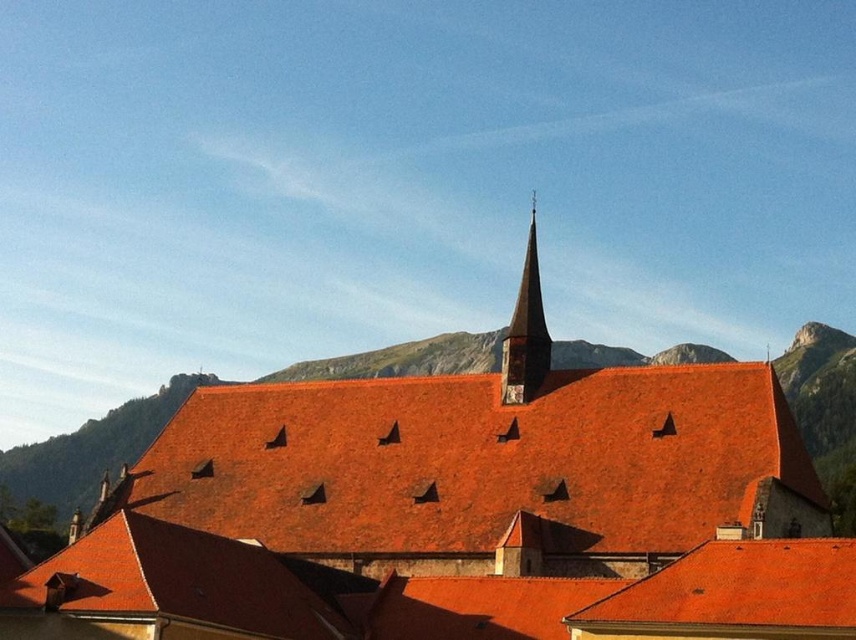
Is shiny orange tiles at center below smooth stone spire at upper center?

Indeed, shiny orange tiles at center is positioned under smooth stone spire at upper center.

The width and height of the screenshot is (856, 640). In order to click on shiny orange tiles at center in this screenshot , I will do `click(484, 464)`.

Which is in front, point (339, 522) or point (527, 385)?

Point (339, 522) is in front.

Locate an element on the screen. This screenshot has height=640, width=856. shiny orange tiles at center is located at coordinates (484, 464).

Between matte orange roof at center and shiny orange tiles at center, which one appears on the right side from the viewer's perspective?

shiny orange tiles at center

Who is positioned more to the left, matte orange roof at center or shiny orange tiles at center?

matte orange roof at center

Measure the distance between point [461,564] and camera.

They are 209.75 feet apart.

At what (x,y) coordinates should I click in order to perform the action: click on matte orange roof at center. Please return your answer as a coordinate pair (x, y). This screenshot has height=640, width=856. Looking at the image, I should click on (456, 516).

Looking at this image, who is higher up, matte orange roof at center or smooth stone spire at upper center?

Positioned higher is smooth stone spire at upper center.

Looking at this image, who is more distant from viewer, (419, 560) or (510, 358)?

The point (510, 358) is more distant.

I want to click on matte orange roof at center, so click(x=456, y=516).